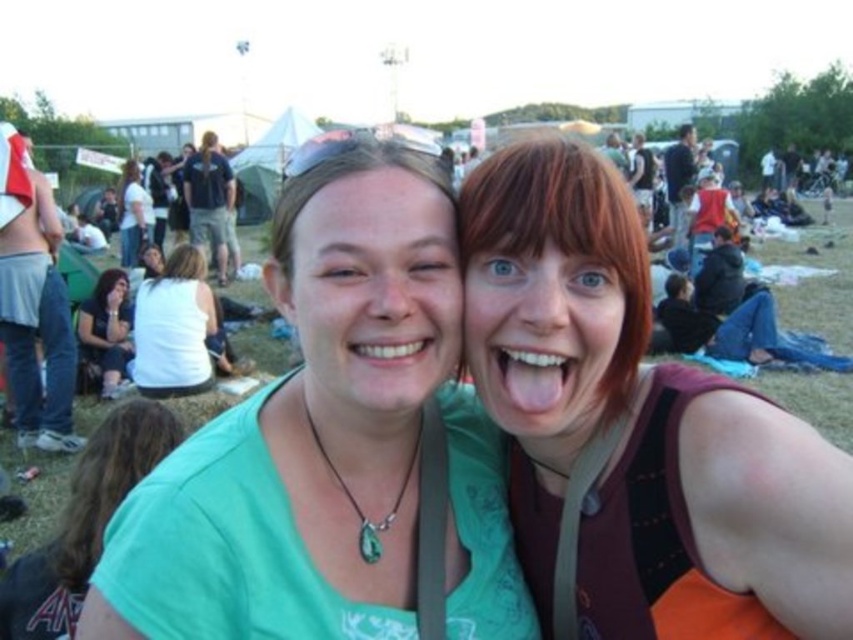
Does green matte shirt at center appear on the left side of green fabric shirt at lower left?

In fact, green matte shirt at center is to the right of green fabric shirt at lower left.

Does point (490, 490) come farther from viewer compared to point (148, 417)?

That is False.

Is point (334, 257) closer to camera compared to point (148, 444)?

Yes, point (334, 257) is in front of point (148, 444).

Image resolution: width=853 pixels, height=640 pixels. What are the coordinates of `green matte shirt at center` in the screenshot? It's located at (328, 444).

Between point (148, 317) and point (119, 392), which one is positioned in front?

Point (148, 317) is in front.

What are the coordinates of `white cotton shirt at center` in the screenshot? It's located at (173, 326).

I want to click on white cotton shirt at center, so [x=173, y=326].

Can you confirm if green fabric shirt at lower left is positioned to the left of white cotton shirt at center?

Incorrect, green fabric shirt at lower left is not on the left side of white cotton shirt at center.

Does green fabric shirt at lower left appear over white cotton shirt at center?

Actually, green fabric shirt at lower left is below white cotton shirt at center.

Is point (86, 536) farther from camera compared to point (149, 344)?

That is False.

I want to click on green fabric shirt at lower left, so click(x=84, y=522).